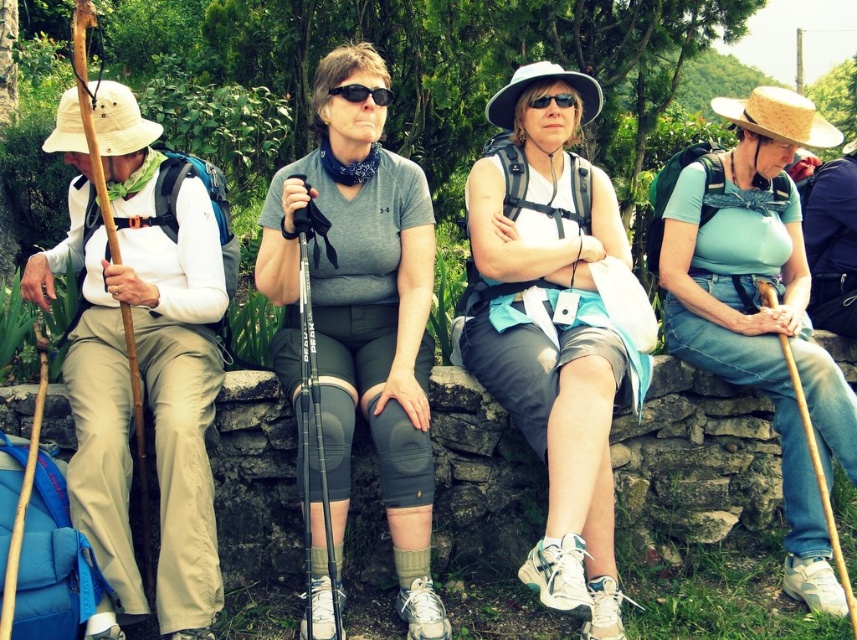
Who is shorter, gray matte knee pads at center or black matte sunglasses at center?

black matte sunglasses at center

Between point (325, 364) and point (363, 97), which one is positioned in front?

Point (325, 364) is more forward.

Where is `gray matte knee pads at center`? The image size is (857, 640). gray matte knee pads at center is located at coordinates (363, 314).

Can you confirm if white matte shorts at center is positioned above black matte sunglasses at center?

No, white matte shorts at center is not above black matte sunglasses at center.

Is point (540, 173) closer to viewer compared to point (388, 88)?

No, it is behind (388, 88).

What do you see at coordinates (553, 326) in the screenshot? I see `white matte shorts at center` at bounding box center [553, 326].

The width and height of the screenshot is (857, 640). In order to click on white matte shorts at center in this screenshot , I will do `click(553, 326)`.

Does white matte shorts at center appear on the left side of gray matte knee pads at center?

In fact, white matte shorts at center is to the right of gray matte knee pads at center.

Is white matte shorts at center smaller than gray matte knee pads at center?

No, white matte shorts at center is not smaller than gray matte knee pads at center.

Is point (529, 312) farther from viewer compared to point (428, 504)?

Yes, it is.

Locate an element on the screen. The image size is (857, 640). white matte shorts at center is located at coordinates (553, 326).